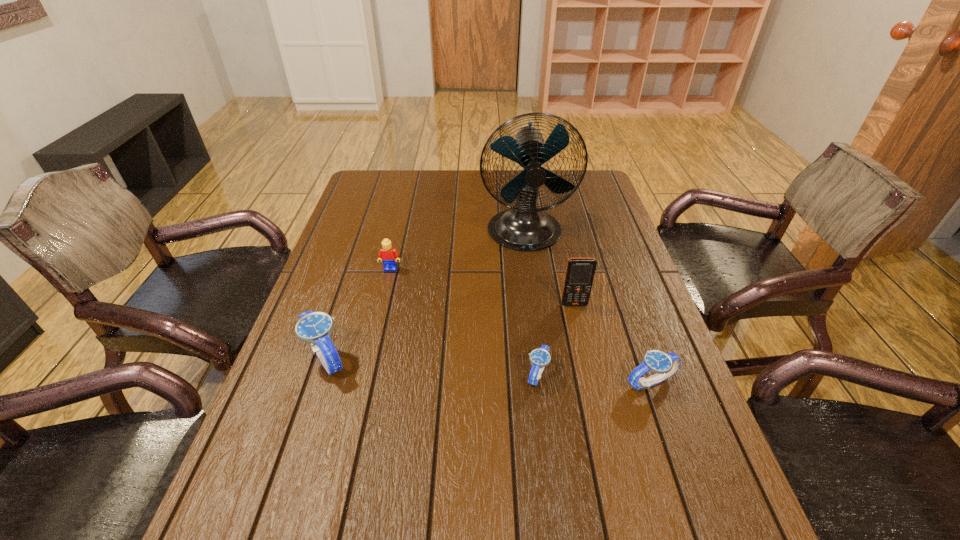
Locate an element on the screen. The width and height of the screenshot is (960, 540). the fifth object from right to left is located at coordinates click(389, 255).

Locate an element on the screen. The image size is (960, 540). Lego is located at coordinates (389, 255).

Find the location of a particular element. The width and height of the screenshot is (960, 540). free space located 0.120m on the back of the leftmost watch is located at coordinates (345, 299).

I want to click on vacant space located 0.260m on the left of the shortest watch, so click(x=411, y=374).

You are a GUI agent. You are given a task and a screenshot of the screen. Output one action in this format:
    pyautogui.click(x=<x>, y=<y>)
    Task: Click on the vacant space positioned on the left of the second shortest object
    
    Given the screenshot: What is the action you would take?
    pyautogui.click(x=479, y=382)

Locate an element on the screen. Image resolution: width=960 pixels, height=540 pixels. vacant space situated 0.050m on the front-facing side of the tallest object is located at coordinates (530, 271).

Locate an element on the screen. Image resolution: width=960 pixels, height=540 pixels. vacant area situated 0.060m on the screen of the third farthest object is located at coordinates (579, 324).

The height and width of the screenshot is (540, 960). Identify the location of vacant space positioned on the front-facing side of the fifth object from right to left. (383, 303).

You are a GUI agent. You are given a task and a screenshot of the screen. Output one action in this format:
    pyautogui.click(x=<x>, y=<y>)
    Task: Click on the watch present at the left edge
    This screenshot has width=960, height=540.
    Given the screenshot: What is the action you would take?
    coord(315,328)

The height and width of the screenshot is (540, 960). Identify the location of Lego located in the left edge section of the desktop. (389, 255).